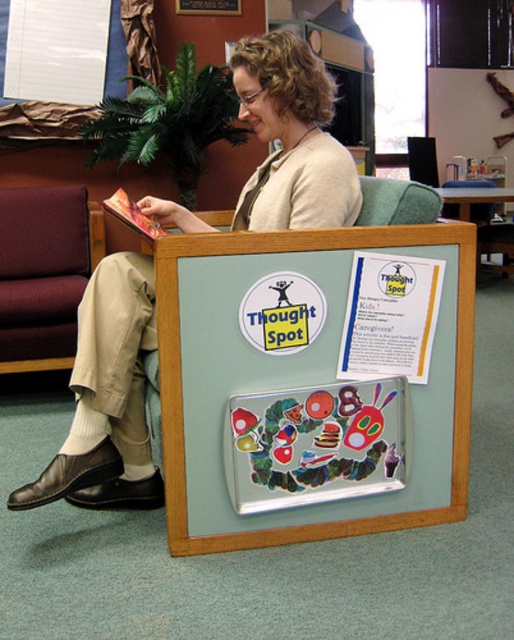
Does metallic silver tray at center have a lesser width compared to maroon fabric armchair at left?

In fact, metallic silver tray at center might be wider than maroon fabric armchair at left.

This screenshot has width=514, height=640. What do you see at coordinates (285, 252) in the screenshot?
I see `metallic silver tray at center` at bounding box center [285, 252].

The height and width of the screenshot is (640, 514). I want to click on metallic silver tray at center, so click(285, 252).

Describe the element at coordinates (106, 396) in the screenshot. I see `light beige sweater at center` at that location.

Which is in front, point (120, 337) or point (2, 253)?

Point (120, 337) is more forward.

Between point (77, 472) and point (40, 257), which one is positioned in front?

Positioned in front is point (77, 472).

The height and width of the screenshot is (640, 514). I want to click on light beige sweater at center, so click(106, 396).

Does metallic silver tray at center appear on the right side of hardcover book at center?

Correct, you'll find metallic silver tray at center to the right of hardcover book at center.

How far apart are metallic silver tray at center and hardcover book at center?

metallic silver tray at center is 21.49 inches away from hardcover book at center.

Where is `metallic silver tray at center`? This screenshot has width=514, height=640. metallic silver tray at center is located at coordinates (285, 252).